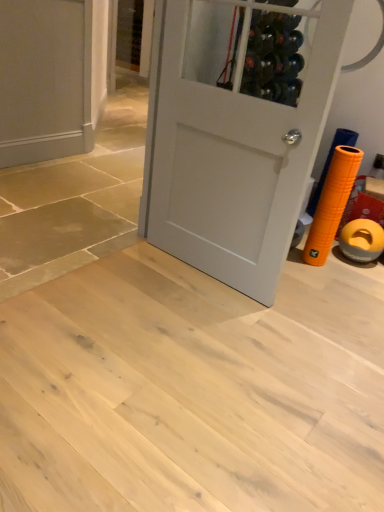
This screenshot has height=512, width=384. I want to click on matte gray door at upper left, which is the 1th door from left to right, so click(45, 80).

What do you see at coordinates (45, 80) in the screenshot? I see `matte gray door at upper left, the first door viewed from the back` at bounding box center [45, 80].

The image size is (384, 512). Find the location of `white matte door at center, which is the 2th door from back to front`. white matte door at center, which is the 2th door from back to front is located at coordinates (238, 133).

Describe the element at coordinates (238, 133) in the screenshot. I see `white matte door at center, placed as the 1th door when sorted from right to left` at that location.

Locate an element on the screen. This screenshot has height=512, width=384. matte gray door at upper left, which ranks as the 2th door in right-to-left order is located at coordinates (45, 80).

Between white matte door at center, placed as the 1th door when sorted from right to left, and matte gray door at upper left, which ranks as the 2th door in right-to-left order, which one appears on the left side from the viewer's perspective?

Positioned to the left is matte gray door at upper left, which ranks as the 2th door in right-to-left order.

Is white matte door at center, which is the 1th door in front-to-back order, in front of or behind matte gray door at upper left, which is the 1th door from left to right, in the image?

white matte door at center, which is the 1th door in front-to-back order, is in front of matte gray door at upper left, which is the 1th door from left to right.

Which is less distant, (263, 220) or (12, 138)?

The point (263, 220) is closer to the camera.

From the image's perspective, is white matte door at center, placed as the 1th door when sorted from right to left, positioned above or below matte gray door at upper left, the first door viewed from the back?

white matte door at center, placed as the 1th door when sorted from right to left, is situated lower than matte gray door at upper left, the first door viewed from the back, in the image.

From a real-world perspective, between white matte door at center, which is the 1th door in front-to-back order, and matte gray door at upper left, which ranks as the 2th door in right-to-left order, who is vertically higher?

From a 3D spatial view, white matte door at center, which is the 1th door in front-to-back order, is above.

Between white matte door at center, which is the 2th door from back to front, and matte gray door at upper left, which is the 1th door from left to right, which one has smaller width?

With smaller width is matte gray door at upper left, which is the 1th door from left to right.

In terms of height, does white matte door at center, the 2th door when ordered from left to right, look taller or shorter compared to matte gray door at upper left, which is the second door from front to back?

white matte door at center, the 2th door when ordered from left to right, is taller than matte gray door at upper left, which is the second door from front to back.

In the scene shown: Considering the sizes of objects white matte door at center, placed as the 1th door when sorted from right to left, and matte gray door at upper left, which ranks as the 2th door in right-to-left order, in the image provided, who is smaller, white matte door at center, placed as the 1th door when sorted from right to left, or matte gray door at upper left, which ranks as the 2th door in right-to-left order,?

matte gray door at upper left, which ranks as the 2th door in right-to-left order.

Is white matte door at center, the 2th door when ordered from left to right, inside the boundaries of matte gray door at upper left, which ranks as the 2th door in right-to-left order, or outside?

white matte door at center, the 2th door when ordered from left to right, exists outside the volume of matte gray door at upper left, which ranks as the 2th door in right-to-left order.

Are white matte door at center, placed as the 1th door when sorted from right to left, and matte gray door at upper left, which is the second door from front to back, located far from each other?

white matte door at center, placed as the 1th door when sorted from right to left, is far away from matte gray door at upper left, which is the second door from front to back.

Is white matte door at center, which is the 2th door from back to front, positioned with its back to matte gray door at upper left, which ranks as the 2th door in right-to-left order?

That's not correct — white matte door at center, which is the 2th door from back to front, is not looking away from matte gray door at upper left, which ranks as the 2th door in right-to-left order.

In the scene shown: What's the angular difference between white matte door at center, which is the 1th door in front-to-back order, and matte gray door at upper left, which ranks as the 2th door in right-to-left order,'s facing directions?

89.6 degrees separate the facing orientations of white matte door at center, which is the 1th door in front-to-back order, and matte gray door at upper left, which ranks as the 2th door in right-to-left order.

This screenshot has width=384, height=512. In order to click on door located in front of the matte gray door at upper left, which is the 1th door from left to right in this screenshot , I will do `click(238, 133)`.

Considering the relative positions of matte gray door at upper left, which is the 1th door from left to right, and white matte door at center, which is the 1th door in front-to-back order, in the image provided, is matte gray door at upper left, which is the 1th door from left to right, to the left or to the right of white matte door at center, which is the 1th door in front-to-back order,?

matte gray door at upper left, which is the 1th door from left to right, is to the left of white matte door at center, which is the 1th door in front-to-back order.

Is the position of matte gray door at upper left, which is the 1th door from left to right, more distant than that of white matte door at center, which is the 1th door in front-to-back order?

Yes.

Is point (11, 115) positioned before point (274, 103)?

That is False.

From the image's perspective, which is below, matte gray door at upper left, which is the second door from front to back, or white matte door at center, which is the 1th door in front-to-back order?

white matte door at center, which is the 1th door in front-to-back order.

From a real-world perspective, is matte gray door at upper left, the first door viewed from the back, positioned under white matte door at center, which is the 1th door in front-to-back order, based on gravity?

Correct, in the physical world, matte gray door at upper left, the first door viewed from the back, is lower than white matte door at center, which is the 1th door in front-to-back order.

Does matte gray door at upper left, which is the second door from front to back, have a greater width compared to white matte door at center, which is the 2th door from back to front?

No, matte gray door at upper left, which is the second door from front to back, is not wider than white matte door at center, which is the 2th door from back to front.

From their relative heights in the image, would you say matte gray door at upper left, which ranks as the 2th door in right-to-left order, is taller or shorter than white matte door at center, the 2th door when ordered from left to right?

Considering their sizes, matte gray door at upper left, which ranks as the 2th door in right-to-left order, has less height than white matte door at center, the 2th door when ordered from left to right.

Which of these two, matte gray door at upper left, which is the 1th door from left to right, or white matte door at center, which is the 1th door in front-to-back order, is bigger?

white matte door at center, which is the 1th door in front-to-back order, is bigger.

Is matte gray door at upper left, the first door viewed from the back, not inside white matte door at center, which is the 2th door from back to front?

That's correct, matte gray door at upper left, the first door viewed from the back, is outside of white matte door at center, which is the 2th door from back to front.

Would you consider matte gray door at upper left, the first door viewed from the back, to be distant from white matte door at center, which is the 1th door in front-to-back order?

Indeed, matte gray door at upper left, the first door viewed from the back, is not near white matte door at center, which is the 1th door in front-to-back order.

Is matte gray door at upper left, which ranks as the 2th door in right-to-left order, aimed at white matte door at center, the 2th door when ordered from left to right?

Yes, matte gray door at upper left, which ranks as the 2th door in right-to-left order, is aimed at white matte door at center, the 2th door when ordered from left to right.

What's the angular difference between matte gray door at upper left, the first door viewed from the back, and white matte door at center, which is the 1th door in front-to-back order,'s facing directions?

89.6 degrees.

Locate an element on the screen. door located above the white matte door at center, placed as the 1th door when sorted from right to left (from the image's perspective) is located at coordinates (45, 80).

Identify the location of door below the white matte door at center, which is the 1th door in front-to-back order (from a real-world perspective). (45, 80).

I want to click on door behind the white matte door at center, which is the 1th door in front-to-back order, so click(x=45, y=80).